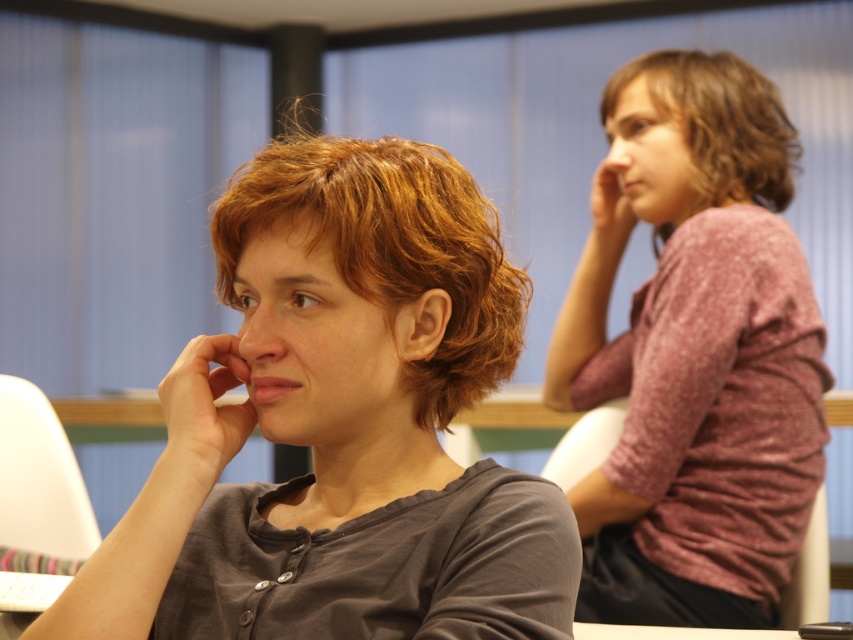
Question: Which of these objects is positioned closest to the matte skin hand at upper right?

Choices:
 (A) dark gray matte shirt at center
 (B) matte skin nose at center

Answer: (A)

Question: Which point appears farthest from the camera in this image?

Choices:
 (A) (688, 256)
 (B) (693, 177)

Answer: (B)

Question: Can you confirm if matte pink shirt at right is thinner than matte skin hand at center?

Choices:
 (A) no
 (B) yes

Answer: (A)

Question: Which point is closer to the camera taking this photo?

Choices:
 (A) (683, 548)
 (B) (415, 349)
 (C) (608, 204)

Answer: (B)

Question: Is matte skin hand at upper right behind black plastic phone at lower right?

Choices:
 (A) no
 (B) yes

Answer: (B)

Question: Is dark gray matte shirt at center bigger than matte skin nose at center?

Choices:
 (A) yes
 (B) no

Answer: (A)